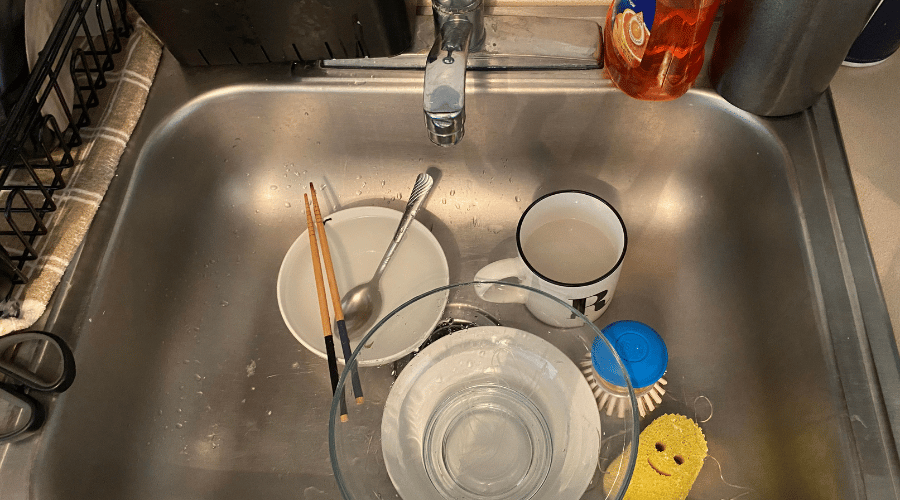
Find the location of `faucet`. faucet is located at coordinates (448, 86).